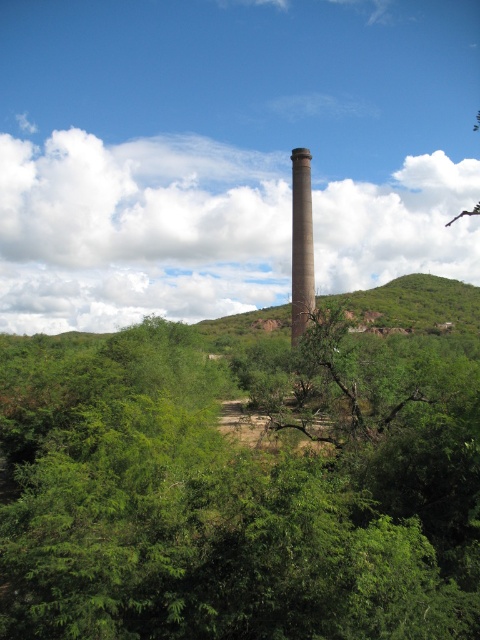
You are a hiker who wants to take a photo of the brown concrete chimney at center without the green leafy tree at center blocking the view. Where should you position yourself relative to the two objects?

The green leafy tree at center is located below the brown concrete chimney at center. To avoid the tree blocking the view, you should position yourself above the green leafy tree at center so that the brown concrete chimney at center is visible above it.

You are planning to set up a small tent between the green leafy tree at center and the green leafy hillside at center. Considering their widths, which one is narrower?

The green leafy tree at center is narrower than the green leafy hillside at center.

You are a hiker planning to take a photo of the brown concrete chimney at center and the green leafy hillside at center. Which object should you focus on first if you want to capture both in a single frame without moving the camera?

You should focus on the green leafy hillside at center first because it might be wider than the brown concrete chimney at center, so it requires a wider angle to include both in the frame.